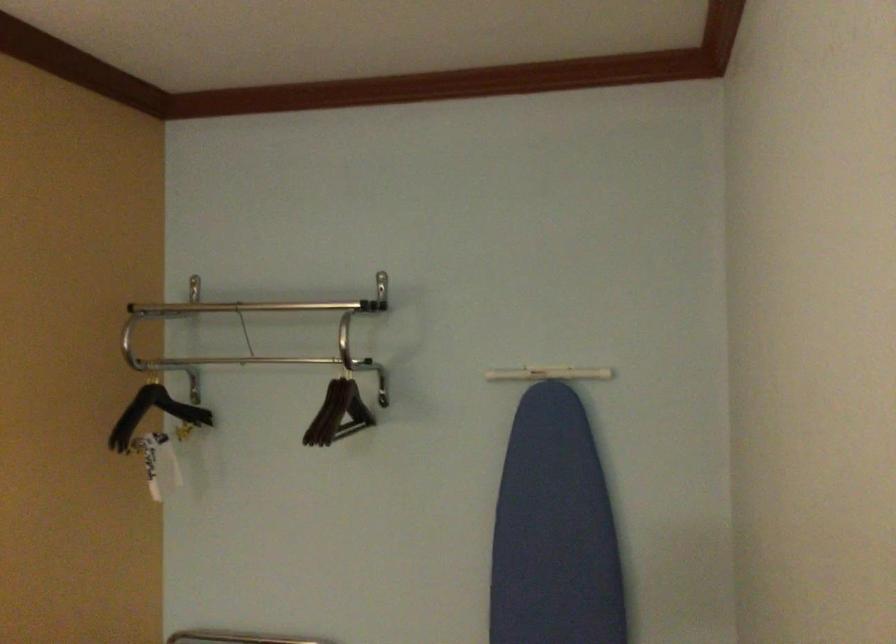
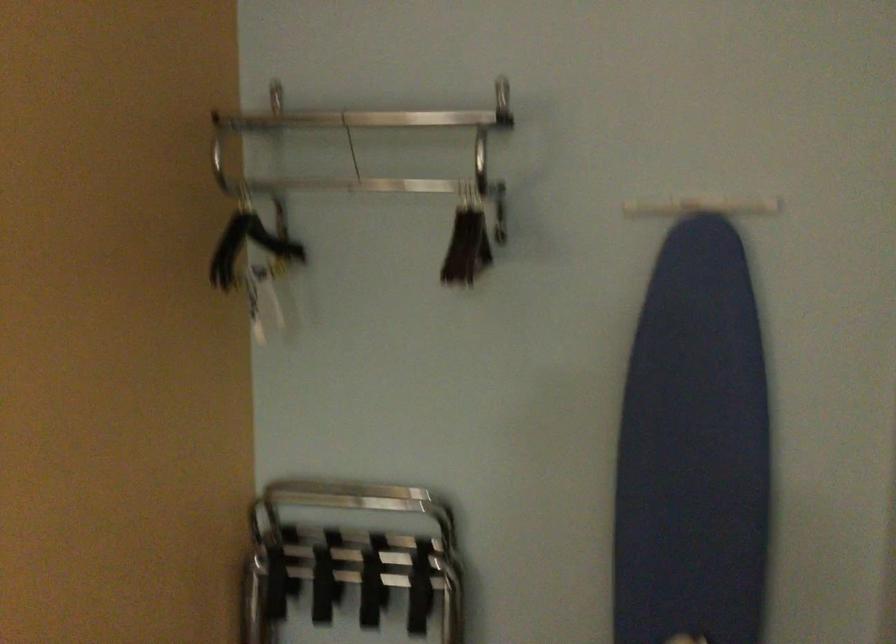
The point at (x=334, y=411) is marked in the first image. Where is the corresponding point in the second image?

(467, 245)